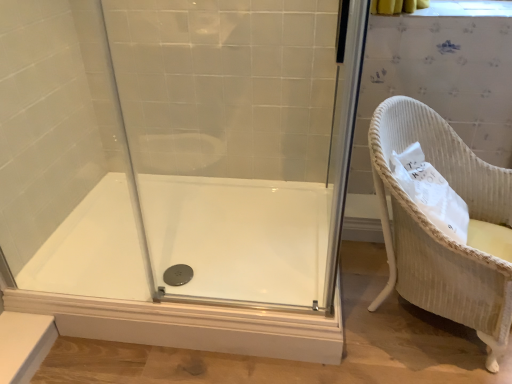
Where is `transparent glass shower door at center`? The width and height of the screenshot is (512, 384). transparent glass shower door at center is located at coordinates [x=178, y=169].

At what (x,y) coordinates should I click in order to perform the action: click on white glossy bath at center. Please return your answer as a coordinate pair (x, y). This screenshot has height=384, width=512. Looking at the image, I should click on (239, 236).

Between white wicker chair at right and white glossy bath at center, which one appears on the right side from the viewer's perspective?

white wicker chair at right.

Is white wicker chair at right completely or partially outside of white glossy bath at center?

Yes, white wicker chair at right is located beyond the bounds of white glossy bath at center.

From a real-world perspective, between white wicker chair at right and white glossy bath at center, who is vertically higher?

white wicker chair at right.

Which object is further away from the camera, white wicker chair at right or white glossy bath at center?

white glossy bath at center is further from the camera.

At what (x,y) coordinates should I click in order to perform the action: click on furniture below the transparent glass shower door at center (from the image's perspective). Please return your answer as a coordinate pair (x, y). Looking at the image, I should click on (437, 229).

Is white wicker chair at right in front of or behind transparent glass shower door at center in the image?

Visually, white wicker chair at right is located behind transparent glass shower door at center.

How different are the orientations of white wicker chair at right and transparent glass shower door at center in degrees?

There is a 62.4-degree angle between the facing directions of white wicker chair at right and transparent glass shower door at center.

Is white wicker chair at right positioned beyond the bounds of transparent glass shower door at center?

white wicker chair at right lies outside transparent glass shower door at center's area.

From a real-world perspective, who is located lower, transparent glass shower door at center or white glossy bath at center?

white glossy bath at center is physically lower.

Is transparent glass shower door at center directly adjacent to white glossy bath at center?

No, transparent glass shower door at center is not touching white glossy bath at center.

In terms of height, does transparent glass shower door at center look taller or shorter compared to white glossy bath at center?

In the image, transparent glass shower door at center appears to be taller than white glossy bath at center.

Does transparent glass shower door at center have a lesser width compared to white glossy bath at center?

Indeed, transparent glass shower door at center has a lesser width compared to white glossy bath at center.

Which object is positioned more to the left, white glossy bath at center or transparent glass shower door at center?

white glossy bath at center.

Based on the photo, does white glossy bath at center have a larger size compared to transparent glass shower door at center?

Yes, white glossy bath at center is bigger than transparent glass shower door at center.

Considering the sizes of white glossy bath at center and transparent glass shower door at center in the image, is white glossy bath at center taller or shorter than transparent glass shower door at center?

Clearly, white glossy bath at center is shorter compared to transparent glass shower door at center.

Which object is more forward, white glossy bath at center or transparent glass shower door at center?

transparent glass shower door at center is in front.

In the scene shown: Is white glossy bath at center to the right of white wicker chair at right from the viewer's perspective?

No.

Is white glossy bath at center bigger or smaller than white wicker chair at right?

white glossy bath at center is smaller than white wicker chair at right.

Does white glossy bath at center turn towards white wicker chair at right?

Yes, white glossy bath at center is turned towards white wicker chair at right.

Can you confirm if transparent glass shower door at center is smaller than white wicker chair at right?

Indeed, transparent glass shower door at center has a smaller size compared to white wicker chair at right.

Locate an element on the screen. The width and height of the screenshot is (512, 384). furniture below the transparent glass shower door at center (from a real-world perspective) is located at coordinates (437, 229).

Are transparent glass shower door at center and white wicker chair at right far apart?

They are positioned close to each other.

Does transparent glass shower door at center have a greater width compared to white wicker chair at right?

In fact, transparent glass shower door at center might be narrower than white wicker chair at right.

Locate an element on the screen. The height and width of the screenshot is (384, 512). furniture above the white glossy bath at center (from a real-world perspective) is located at coordinates (437, 229).

In order to click on furniture behind the transparent glass shower door at center in this screenshot , I will do `click(437, 229)`.

Based on their spatial positions, is white wicker chair at right or transparent glass shower door at center closer to white glossy bath at center?

transparent glass shower door at center is closer to white glossy bath at center.

From the image, which object appears to be nearer to white glossy bath at center, transparent glass shower door at center or white wicker chair at right?

transparent glass shower door at center.

Looking at the image, which one is located closer to transparent glass shower door at center, white glossy bath at center or white wicker chair at right?

white glossy bath at center is closer to transparent glass shower door at center.

Which object lies nearer to the anchor point transparent glass shower door at center, white wicker chair at right or white glossy bath at center?

Among the two, white glossy bath at center is located nearer to transparent glass shower door at center.

Based on their spatial positions, is transparent glass shower door at center or white glossy bath at center further from white wicker chair at right?

Based on the image, transparent glass shower door at center appears to be further to white wicker chair at right.

Which object lies nearer to the anchor point white wicker chair at right, white glossy bath at center or transparent glass shower door at center?

The object closer to white wicker chair at right is white glossy bath at center.

You are a GUI agent. You are given a task and a screenshot of the screen. Output one action in this format:
    pyautogui.click(x=<x>, y=<y>)
    Task: Click on the shower door situated between white glossy bath at center and white wicker chair at right from left to right
    
    Given the screenshot: What is the action you would take?
    pyautogui.click(x=178, y=169)